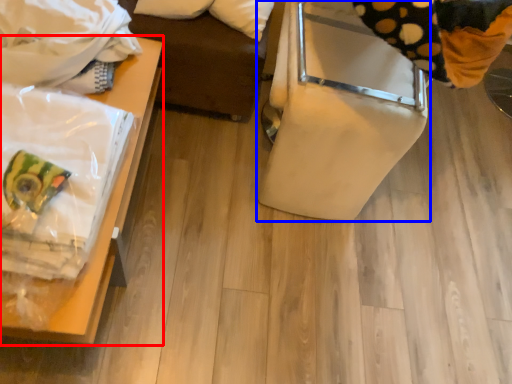
Question: Which point is further to the camera, furniture (highlighted by a red box) or furniture (highlighted by a blue box)?

Choices:
 (A) furniture
 (B) furniture

Answer: (B)